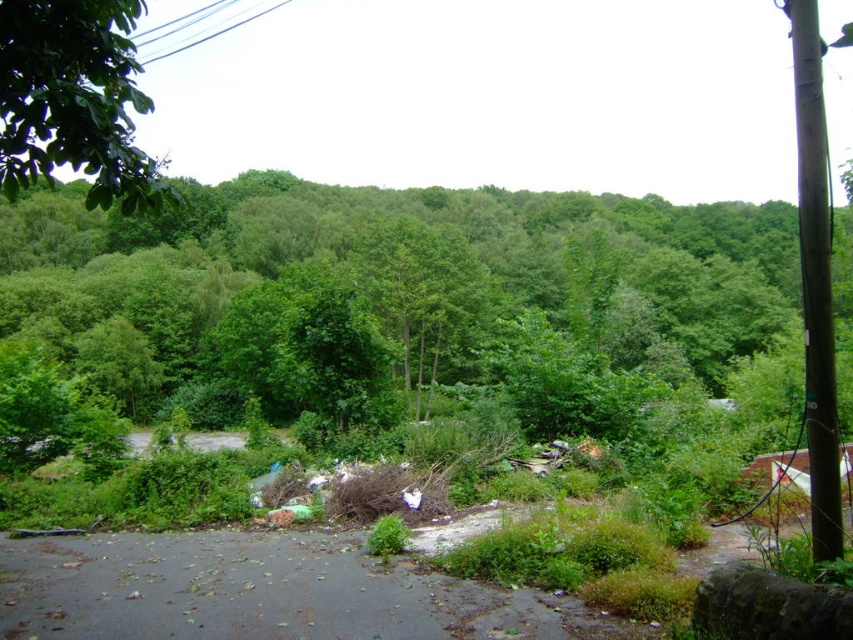
Between green leafy tree at upper left and black wire at upper left, which one appears on the right side from the viewer's perspective?

Positioned to the right is green leafy tree at upper left.

Find the location of `green leafy tree at upper left`. green leafy tree at upper left is located at coordinates (74, 100).

Find the location of a particular element. The image size is (853, 640). green leafy tree at upper left is located at coordinates (74, 100).

Find the location of `green leafy tree at upper left`. green leafy tree at upper left is located at coordinates (74, 100).

Is point (822, 268) less distant than point (195, 35)?

Yes, it is.

Is brown wood pole at right thinner than black wire at upper left?

Incorrect, brown wood pole at right's width is not less than black wire at upper left's.

What do you see at coordinates (815, 280) in the screenshot? Image resolution: width=853 pixels, height=640 pixels. I see `brown wood pole at right` at bounding box center [815, 280].

Find the location of a particular element. brown wood pole at right is located at coordinates (815, 280).

From the picture: Is green leafy tree at upper left to the right of brown wood pole at right from the viewer's perspective?

Incorrect, green leafy tree at upper left is not on the right side of brown wood pole at right.

Does green leafy tree at upper left lie in front of brown wood pole at right?

No, green leafy tree at upper left is further to the viewer.

Is point (41, 106) positioned in front of point (810, 340)?

That is False.

What are the coordinates of `green leafy tree at upper left` in the screenshot? It's located at click(x=74, y=100).